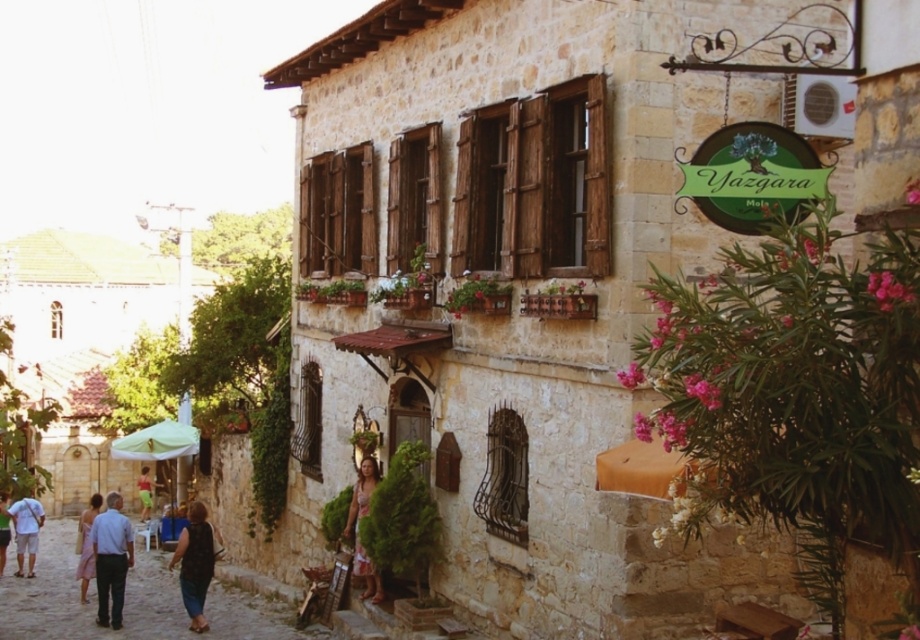
Question: Does green textured dress at center appear on the left side of light pink fabric dress at lower left?

Choices:
 (A) yes
 (B) no

Answer: (B)

Question: Which object is closer to the camera taking this photo?

Choices:
 (A) smooth stone alley at lower left
 (B) dark blue denim jeans at lower left
 (C) dark blue jeans at lower left

Answer: (A)

Question: Is smooth stone alley at lower left further to the viewer compared to white cotton shorts at lower left?

Choices:
 (A) yes
 (B) no

Answer: (B)

Question: Which point is closer to the camera?

Choices:
 (A) white cotton shorts at lower left
 (B) green textured dress at center
 (C) matte pink shirt at center

Answer: (B)

Question: Is green textured dress at center below white cotton shorts at lower left?

Choices:
 (A) yes
 (B) no

Answer: (B)

Question: Estimate the real-world distances between objects in this image. Which object is closer to the smooth stone alley at lower left?

Choices:
 (A) green textured dress at center
 (B) matte pink shirt at center
 (C) light blue jeans at lower left
 (D) green fabric umbrella at lower left

Answer: (C)